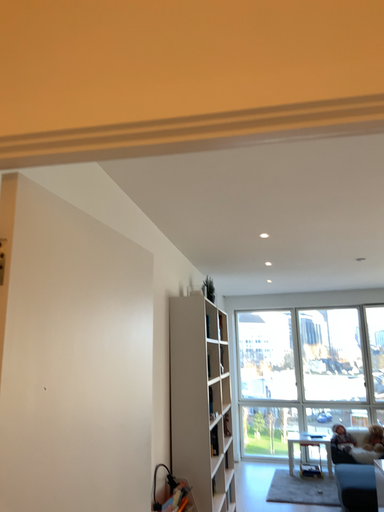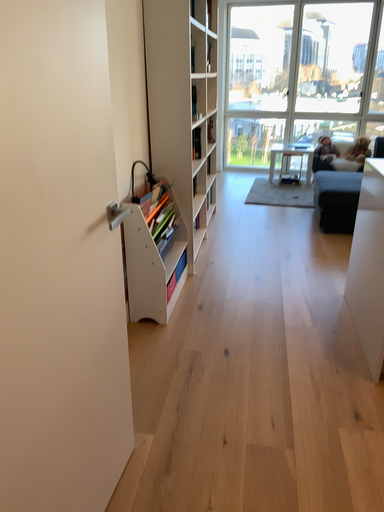
Question: Which way did the camera rotate in the video?

Choices:
 (A) rotated downward
 (B) rotated upward

Answer: (A)